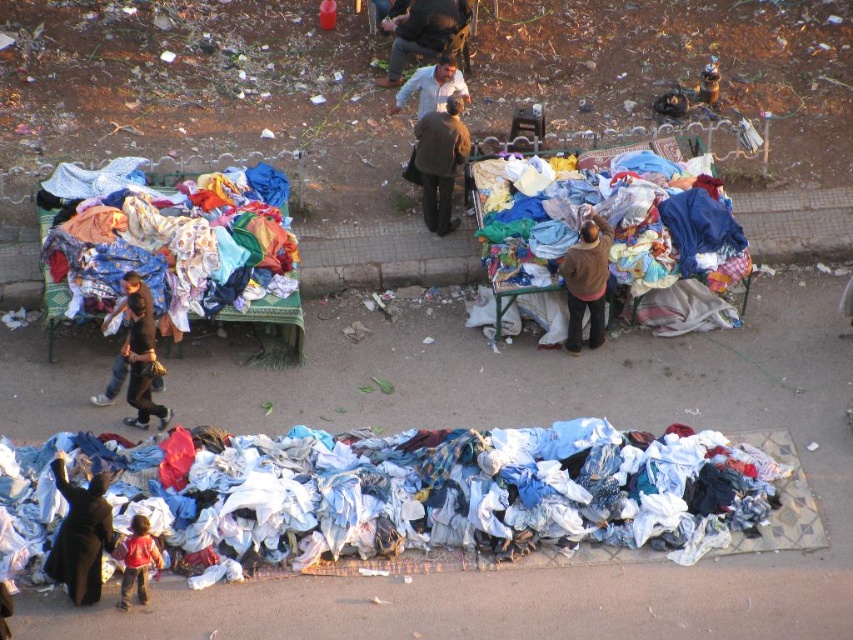
Is matte brown coat at center closer to camera compared to brown woolen sweater at center?

No, matte brown coat at center is further to the viewer.

Is matte brown coat at center further to the viewer compared to brown woolen sweater at center?

Yes, it is behind brown woolen sweater at center.

What are the coordinates of `matte brown coat at center` in the screenshot? It's located at (439, 163).

Which is above, white cotton laundry at lower center or dark brown leather jacket at left?

dark brown leather jacket at left is above.

Does white cotton laundry at lower center lie behind dark brown leather jacket at left?

No, white cotton laundry at lower center is closer to the viewer.

Who is more distant from viewer, (151, 529) or (120, 356)?

Positioned behind is point (120, 356).

Find the location of a particular element. white cotton laundry at lower center is located at coordinates (450, 496).

The height and width of the screenshot is (640, 853). What do you see at coordinates (80, 536) in the screenshot?
I see `dark brown fabric at lower left` at bounding box center [80, 536].

Where is `dark brown fabric at lower left`? The width and height of the screenshot is (853, 640). dark brown fabric at lower left is located at coordinates (80, 536).